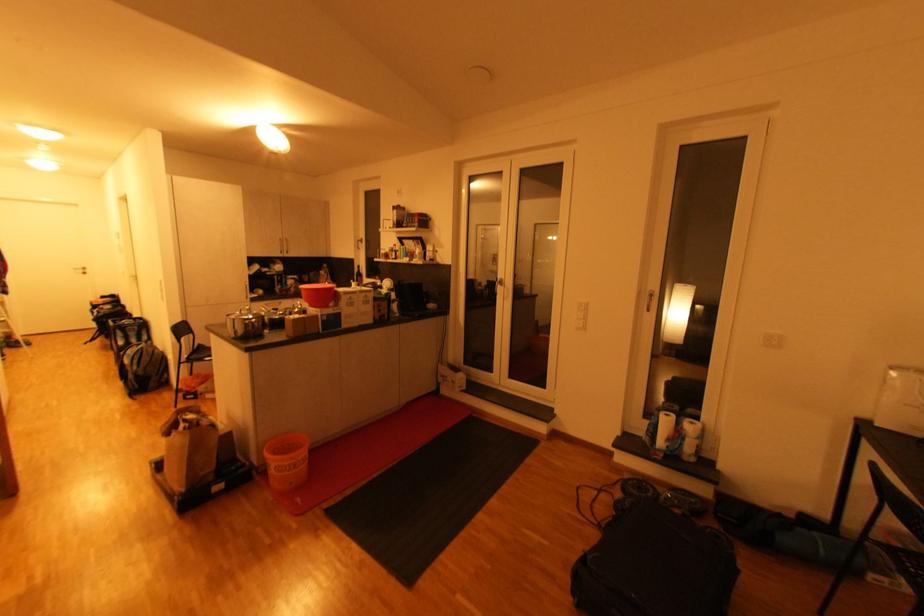
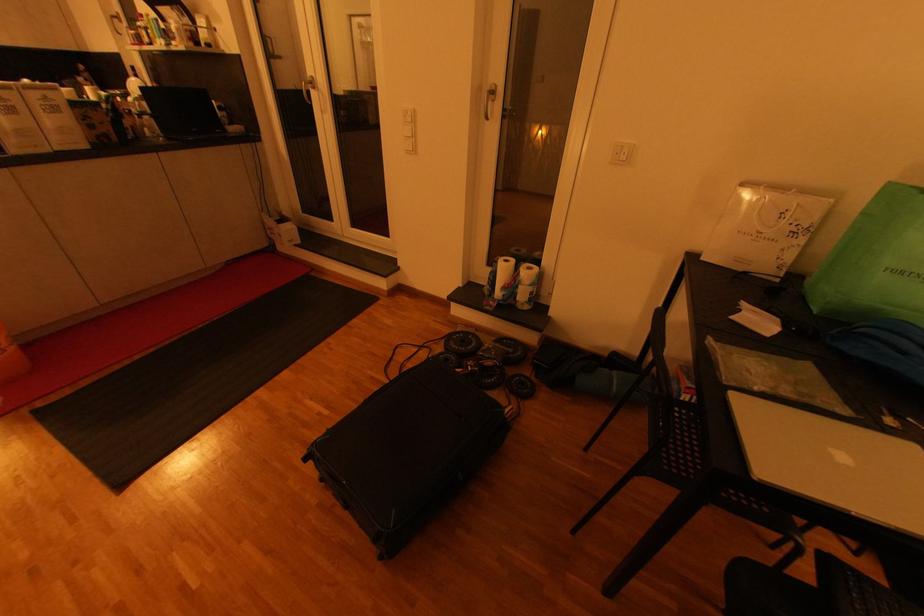
The point at [584,330] is marked in the first image. Where is the corresponding point in the second image?

(412, 153)